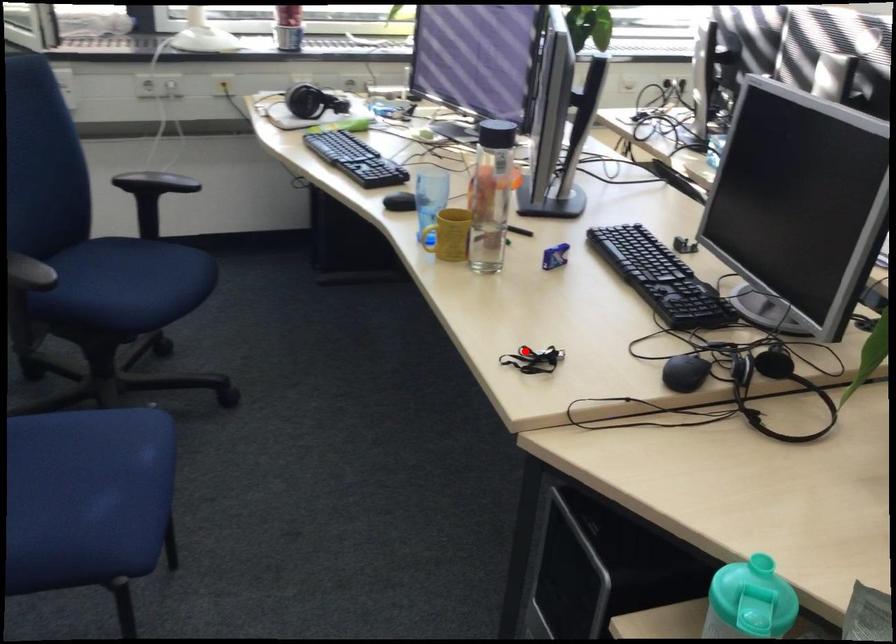
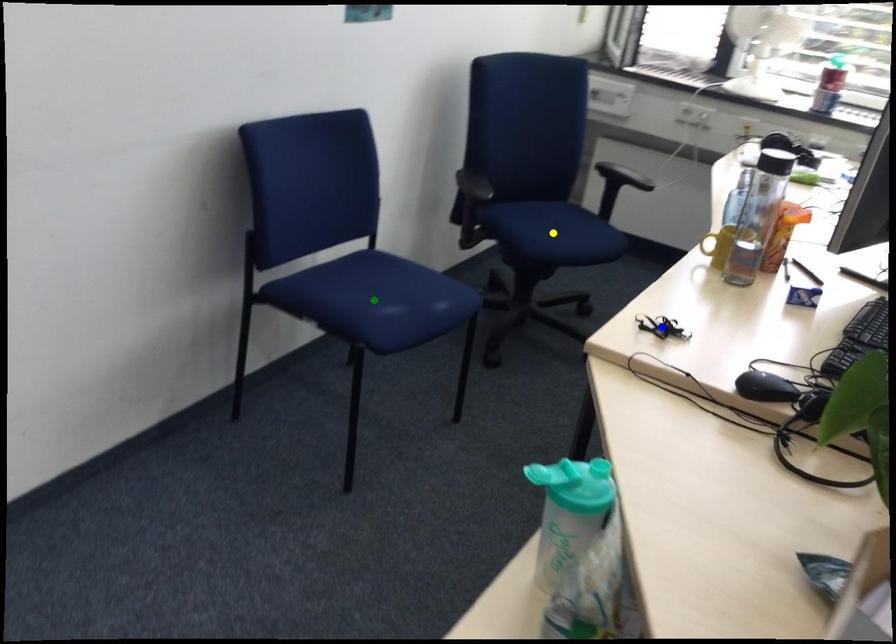
Question: I am providing you with two images of the same scene from different viewpoints. A red point is marked on the first image. You are given multiple points on the second image. Which point in image 2 represents the same 3d spot as the red point in image 1?

Choices:
 (A) yellow point
 (B) green point
 (C) blue point

Answer: (C)